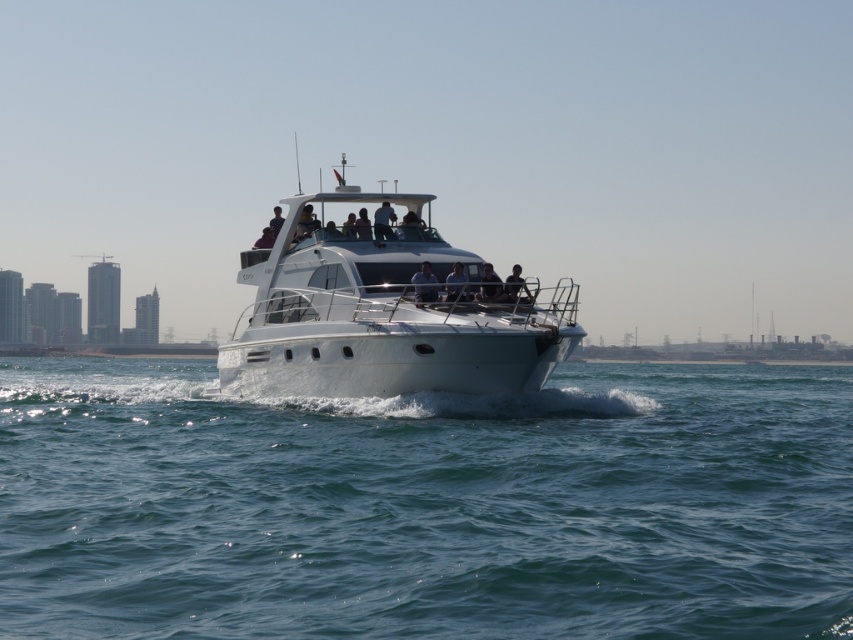
You are a photographer trying to capture the white glossy boat at center. Based on its 2D location coordinates, where should you position your camera to ensure the boat is centered in your shot?

To center the white glossy boat at center in your shot, position your camera so that it aligns with the boat at the coordinates point [381,310].

You are a photographer trying to capture a clear image of the white glossy boat at center and the smooth black shirt at center. Which object should you focus on first to ensure both are in focus without adjusting your camera settings?

The white glossy boat at center is in front of the smooth black shirt at center, so you should focus on the white glossy boat at center first to ensure both are in focus.

You are a photographer on the yacht and want to capture both the matte black shirt at center and the dark blue fabric jacket at center in a single shot. Which object should you focus on first to ensure both are in frame?

You should focus on the matte black shirt at center first because it has a greater height compared to the dark blue fabric jacket at center, ensuring both are captured in the frame.